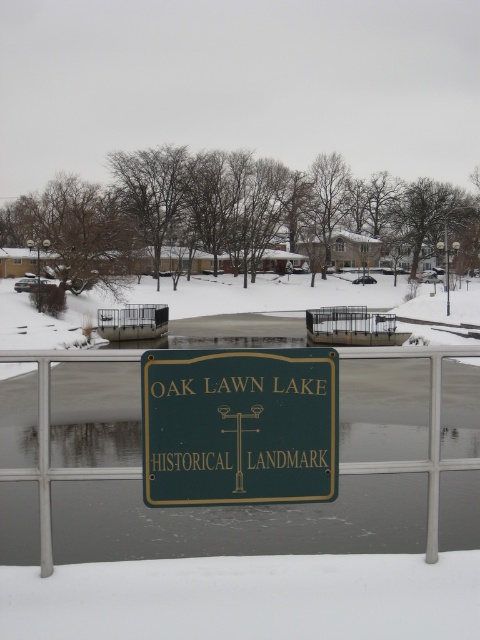
Question: Does green polished wood sign at center have a larger size compared to green metal sign at center?

Choices:
 (A) no
 (B) yes

Answer: (A)

Question: Which point is closer to the camera?

Choices:
 (A) green metal sign at center
 (B) green polished wood sign at center

Answer: (B)

Question: Does green polished wood sign at center appear over green metal sign at center?

Choices:
 (A) no
 (B) yes

Answer: (B)

Question: Is green polished wood sign at center further to camera compared to green metal sign at center?

Choices:
 (A) no
 (B) yes

Answer: (A)